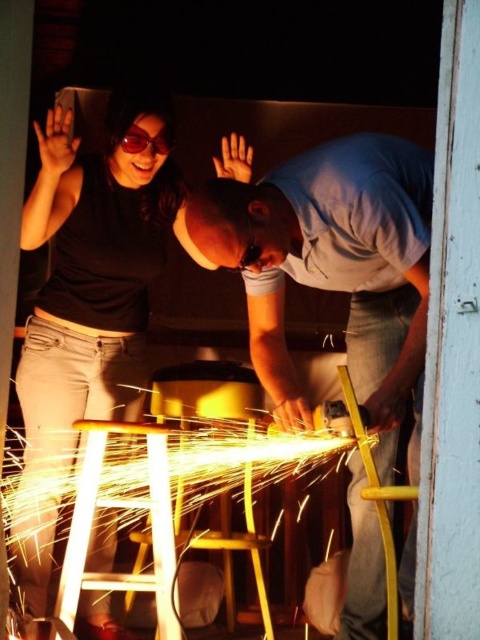
Question: Which object is closer to the camera taking this photo?

Choices:
 (A) black matte shirt at upper left
 (B) matte gray shirt at center

Answer: (B)

Question: Does matte gray shirt at center have a greater width compared to black matte shirt at upper left?

Choices:
 (A) no
 (B) yes

Answer: (B)

Question: Which point is farther to the camera?

Choices:
 (A) (49, 148)
 (B) (331, 172)

Answer: (A)

Question: Which point is closer to the camera taking this photo?

Choices:
 (A) (354, 252)
 (B) (147, 253)

Answer: (A)

Question: Can you confirm if matte gray shirt at center is wider than black matte shirt at upper left?

Choices:
 (A) no
 (B) yes

Answer: (B)

Question: Is matte gray shirt at center behind black matte shirt at upper left?

Choices:
 (A) yes
 (B) no

Answer: (B)